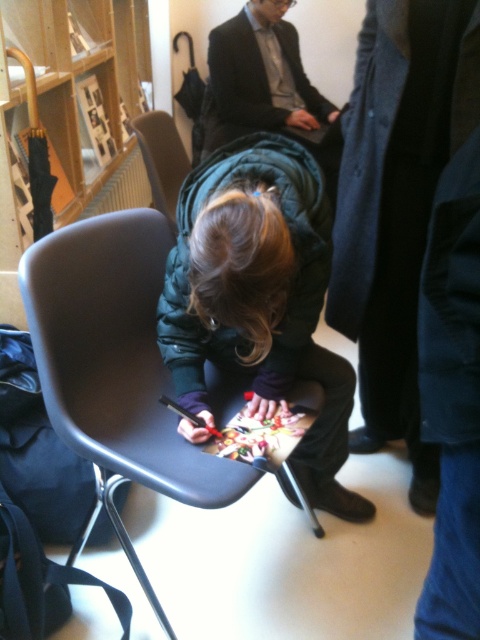
Question: Which point is farther from the camera taking this photo?

Choices:
 (A) (220, 220)
 (B) (279, 38)
 (C) (311, 512)
 (D) (157, 129)

Answer: (B)

Question: Which object is the closest to the dark gray suit at upper center?

Choices:
 (A) matte gray chair at center
 (B) dark green quilted jacket at center

Answer: (A)

Question: Considering the relative positions of matte gray plastic chair at center and dark green quilted jacket at center in the image provided, where is matte gray plastic chair at center located with respect to dark green quilted jacket at center?

Choices:
 (A) below
 (B) above

Answer: (A)

Question: Can you confirm if dark green quilted jacket at center is thinner than matte gray chair at center?

Choices:
 (A) yes
 (B) no

Answer: (B)

Question: Is matte gray plastic chair at center above dark gray suit at upper center?

Choices:
 (A) yes
 (B) no

Answer: (B)

Question: Which object is positioned closest to the matte gray plastic chair at center?

Choices:
 (A) dark green quilted jacket at center
 (B) dark gray suit at upper center

Answer: (A)